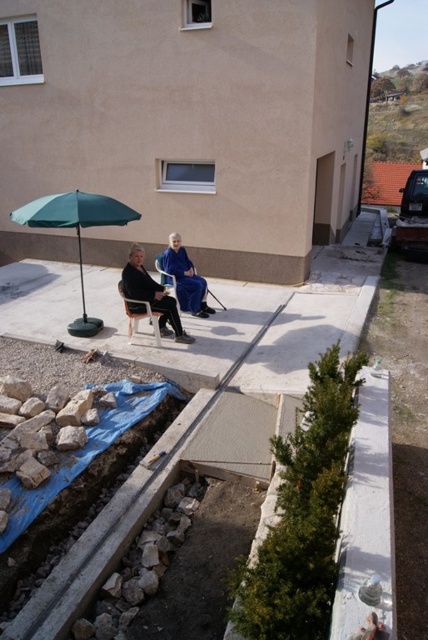
Which is more to the right, green fabric umbrella at left or blue fabric dress at center?

Positioned to the right is blue fabric dress at center.

Does green fabric umbrella at left have a larger size compared to blue fabric dress at center?

Correct, green fabric umbrella at left is larger in size than blue fabric dress at center.

Who is more distant from viewer, (62, 196) or (175, 252)?

The point (175, 252) is more distant.

Locate an element on the screen. This screenshot has width=428, height=640. green fabric umbrella at left is located at coordinates (76, 230).

Locate an element on the screen. green fabric umbrella at left is located at coordinates (76, 230).

Does point (27, 208) come behind point (127, 332)?

No, it is not.

In order to click on green fabric umbrella at left in this screenshot , I will do tap(76, 230).

Does blue fabric dress at center lie behind wooden folding chair at center?

Yes.

Measure the distance between blue fabric dress at center and wooden folding chair at center.

The distance of blue fabric dress at center from wooden folding chair at center is 96.05 centimeters.

Is point (186, 296) farther from viewer compared to point (155, 342)?

Yes, point (186, 296) is behind point (155, 342).

Find the location of a particular element. blue fabric dress at center is located at coordinates (186, 278).